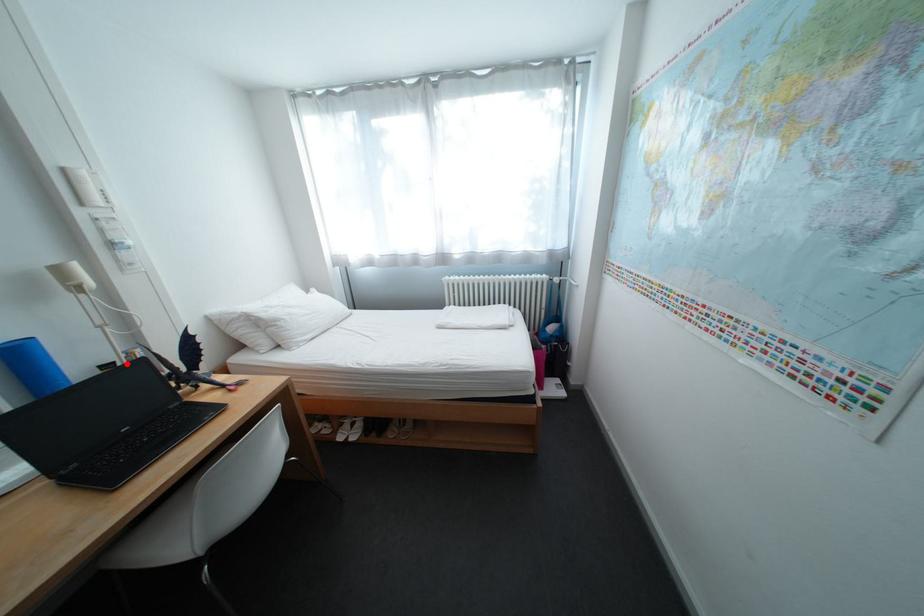
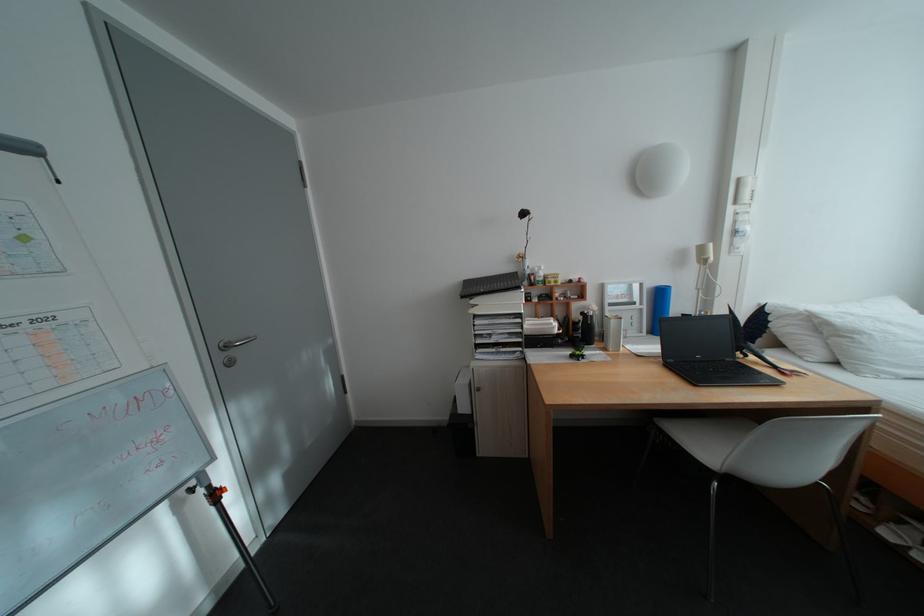
In the second image, find the point that corresponds to the highlighted location in the first image.

(703, 315)